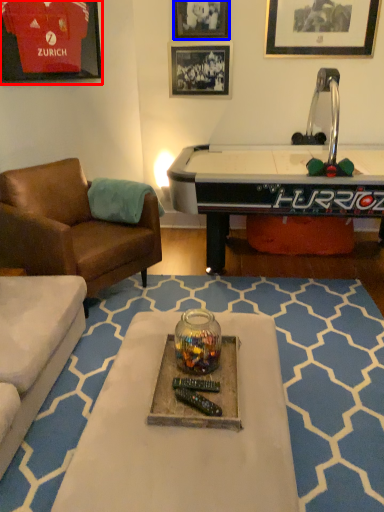
Question: Which object is closer to the camera taking this photo, picture frame (highlighted by a red box) or picture frame (highlighted by a blue box)?

Choices:
 (A) picture frame
 (B) picture frame

Answer: (A)